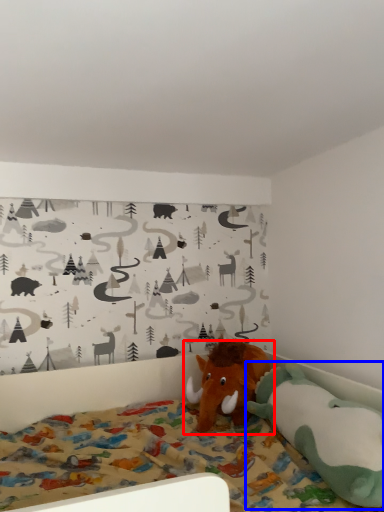
Question: Among these objects, which one is nearest to the camera, toy (highlighted by a red box) or toy (highlighted by a blue box)?

Choices:
 (A) toy
 (B) toy

Answer: (B)